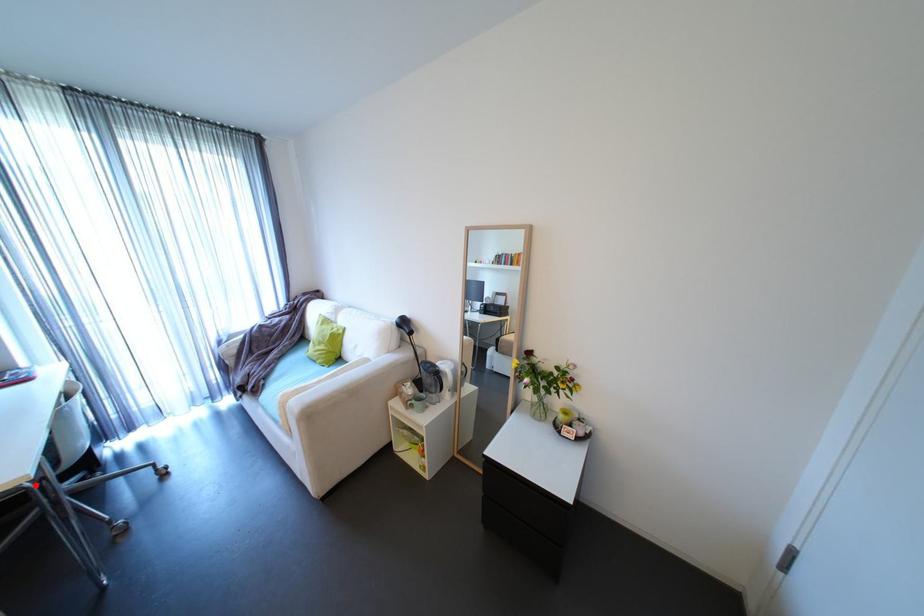
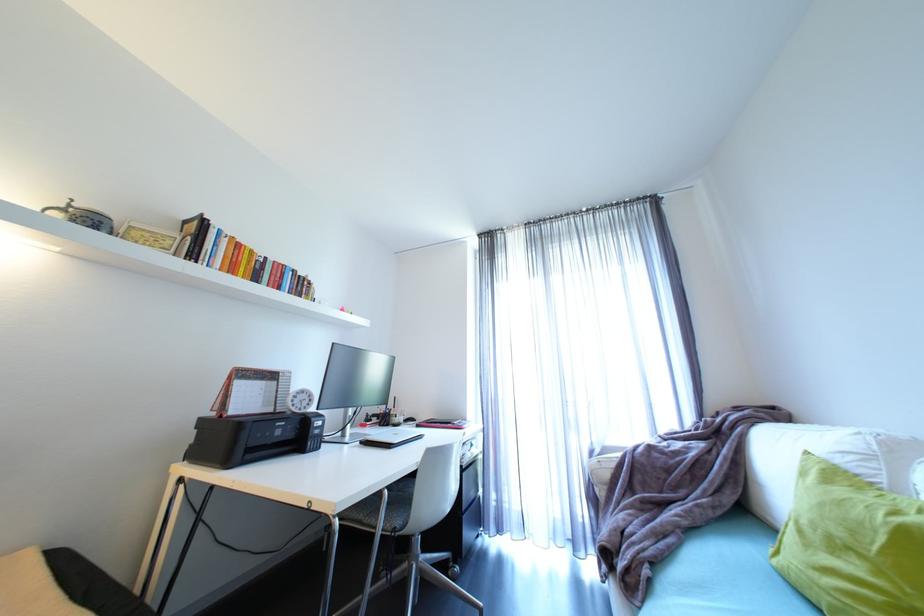
Question: I am providing you with two images of the same scene from different viewpoints. A red point is shown in image1. For the corresponding object point in image2, is it positioned nearer or farther from the camera?

Choices:
 (A) Nearer
 (B) Farther

Answer: (B)